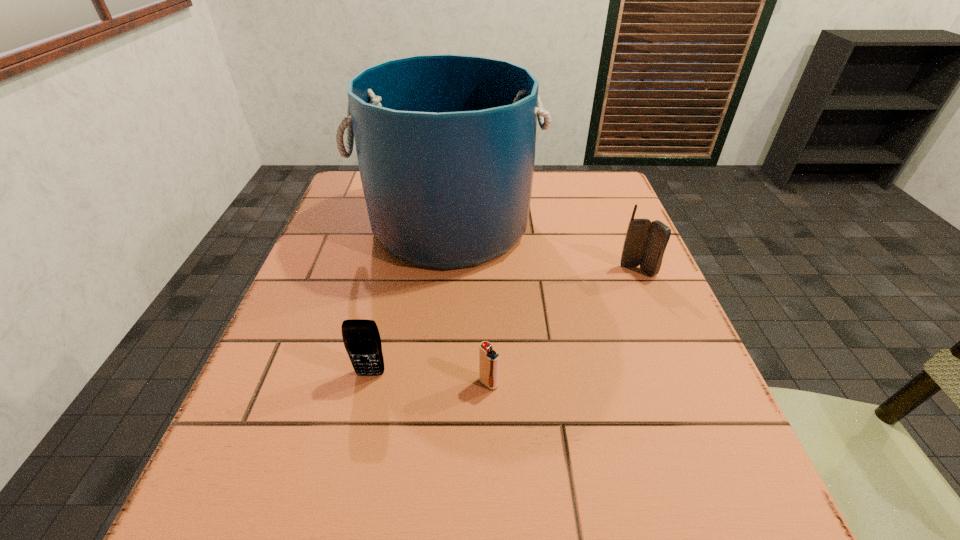
Where is `free space between the right cellular telephone and the igniter`? free space between the right cellular telephone and the igniter is located at coordinates (564, 327).

Where is `vacant area between the shortest object and the left cellular telephone`? Image resolution: width=960 pixels, height=540 pixels. vacant area between the shortest object and the left cellular telephone is located at coordinates (429, 379).

The width and height of the screenshot is (960, 540). Find the location of `unoccupied position between the taller cellular telephone and the igniter`. unoccupied position between the taller cellular telephone and the igniter is located at coordinates (564, 327).

Identify the location of free space between the igniter and the taller cellular telephone. (564, 327).

Image resolution: width=960 pixels, height=540 pixels. In order to click on free area in between the bucket and the rightmost object in this screenshot , I will do `click(543, 248)`.

This screenshot has height=540, width=960. I want to click on free space between the second shortest object and the igniter, so click(x=429, y=379).

I want to click on vacant space that is in between the bucket and the taller cellular telephone, so click(543, 248).

The height and width of the screenshot is (540, 960). Find the location of `free area in between the bucket and the shortest object`. free area in between the bucket and the shortest object is located at coordinates (468, 305).

At what (x,y) coordinates should I click in order to perform the action: click on free space between the shortest object and the tallest object. Please return your answer as a coordinate pair (x, y). This screenshot has height=540, width=960. Looking at the image, I should click on [468, 305].

The height and width of the screenshot is (540, 960). What are the coordinates of `object that stands as the second closest to the left cellular telephone` in the screenshot? It's located at (445, 143).